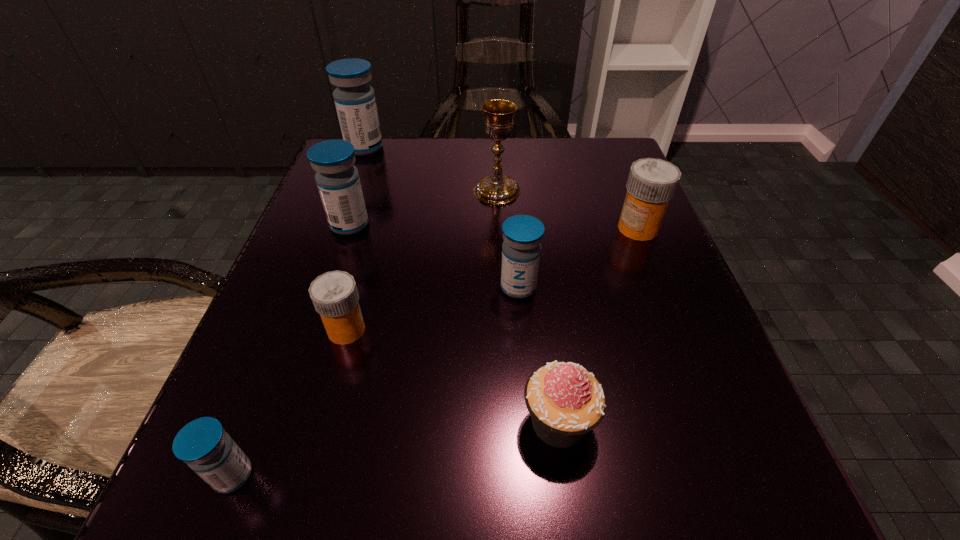
Where is `vacant space situated 0.310m on the front of the second nearest blue medicine`? vacant space situated 0.310m on the front of the second nearest blue medicine is located at coordinates [x=539, y=524].

Locate an element on the screen. This screenshot has width=960, height=540. vacant region located on the left of the pink cupcake is located at coordinates (274, 422).

Identify the location of vacant region located on the label side of the fifth farthest medicine. (610, 330).

At what (x,y) coordinates should I click in order to perform the action: click on vacant space located on the back of the nearest medicine. Please return your answer as a coordinate pair (x, y). The width and height of the screenshot is (960, 540). Looking at the image, I should click on 319,252.

Find the location of `medicine located at the far edge`. medicine located at the far edge is located at coordinates (355, 102).

This screenshot has height=540, width=960. Find the location of `chalice located at the far edge`. chalice located at the far edge is located at coordinates (496, 189).

This screenshot has height=540, width=960. What are the coordinates of `cupcake at the near edge` in the screenshot? It's located at (566, 401).

This screenshot has height=540, width=960. I want to click on medicine that is positioned at the near edge, so click(x=203, y=444).

At what (x,y) coordinates should I click in order to perform the action: click on object present at the right edge. Please return your answer as a coordinate pair (x, y). This screenshot has width=960, height=540. Looking at the image, I should click on (651, 183).

This screenshot has width=960, height=540. What are the coordinates of `object at the far left corner` in the screenshot? It's located at (355, 102).